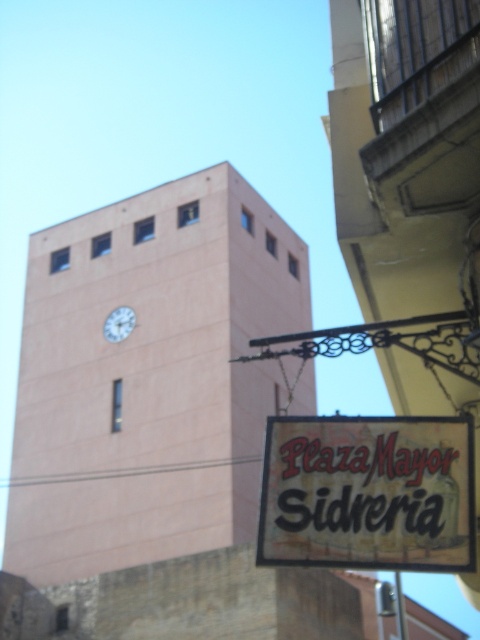
Question: Among these points, which one is farthest from the camera?

Choices:
 (A) (362, 499)
 (B) (123, 316)
 (C) (175, 548)

Answer: (B)

Question: Does matte pink clock tower at center lie in front of matte black sign at lower right?

Choices:
 (A) no
 (B) yes

Answer: (A)

Question: Which object is farther from the camera taking this photo?

Choices:
 (A) white glossy clock at upper center
 (B) matte pink clock tower at center

Answer: (A)

Question: Does matte pink clock tower at center have a smaller size compared to matte black sign at lower right?

Choices:
 (A) no
 (B) yes

Answer: (A)

Question: Does matte pink clock tower at center have a smaller size compared to white glossy clock at upper center?

Choices:
 (A) no
 (B) yes

Answer: (A)

Question: Estimate the real-world distances between objects in this image. Which object is closer to the matte pink clock tower at center?

Choices:
 (A) white glossy clock at upper center
 (B) matte black sign at lower right

Answer: (A)